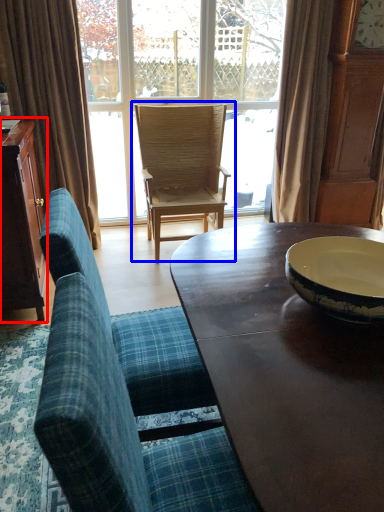
Question: Among these objects, which one is farthest to the camera, cabinetry (highlighted by a red box) or chair (highlighted by a blue box)?

Choices:
 (A) cabinetry
 (B) chair

Answer: (B)